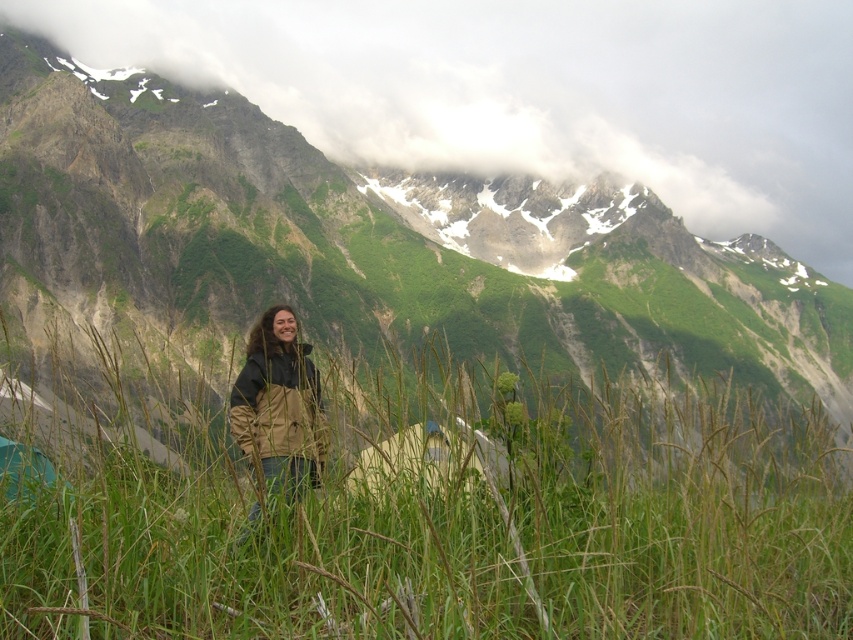
You are planning to set up a campsite and need to know the relative positions of the tents. According to the scene, where is the white canvas tent at center in relation to the green fabric tent at lower left?

The white canvas tent at center is located below the green fabric tent at lower left.